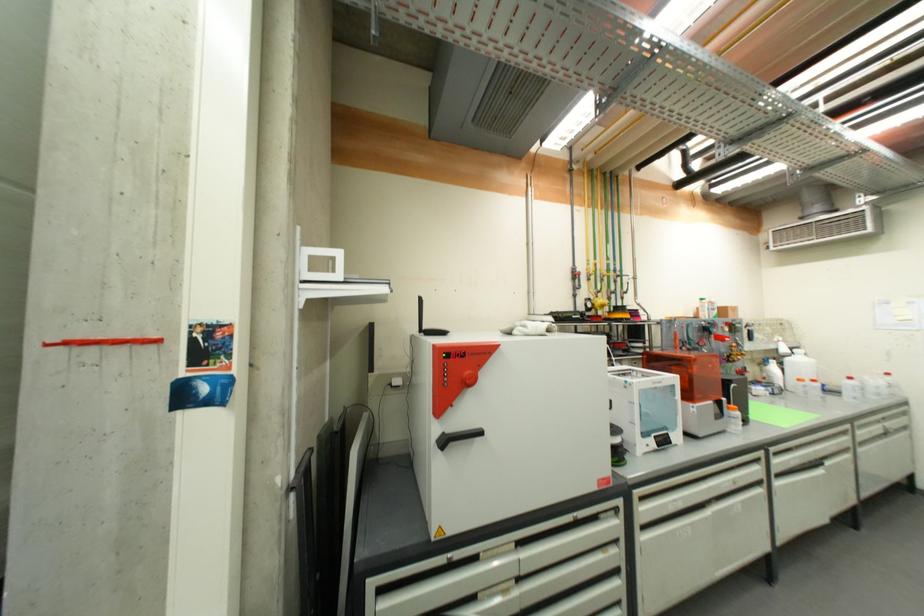
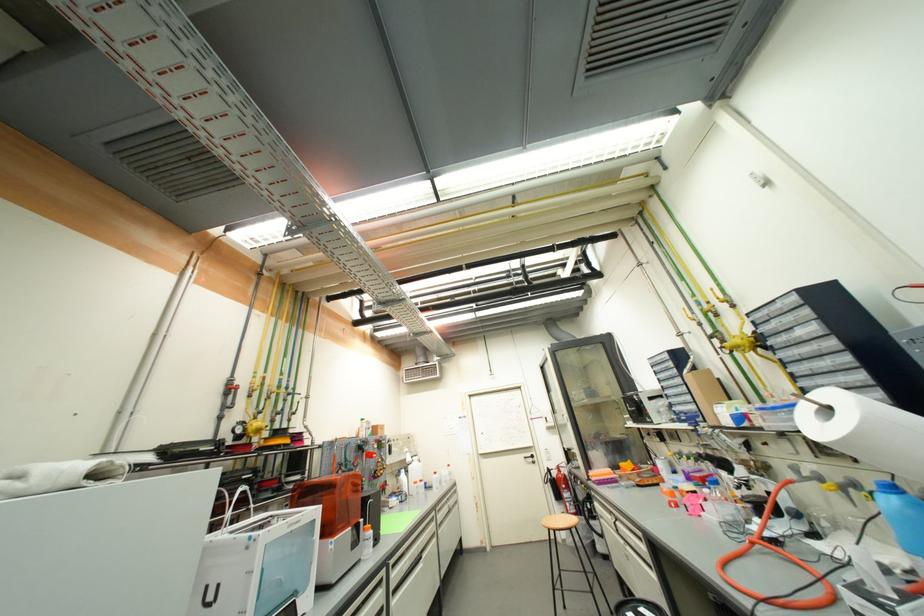
The first image is from the beginning of the video and the second image is from the end. How did the camera likely rotate when shooting the video?

The camera's rotation is toward right-up.